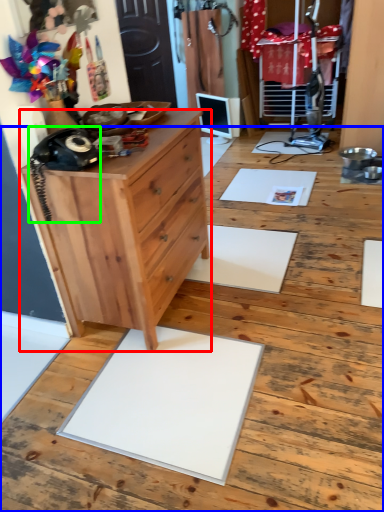
Question: Which object is the farthest from chest of drawers (highlighted by a red box)? Choose among these: hardwood (highlighted by a blue box) or equipment (highlighted by a green box).

Choices:
 (A) hardwood
 (B) equipment

Answer: (A)